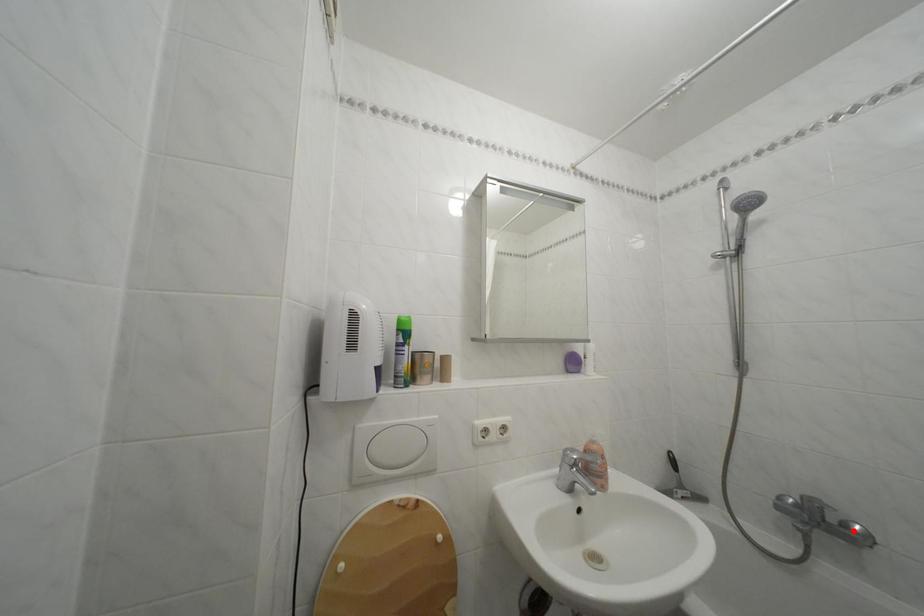
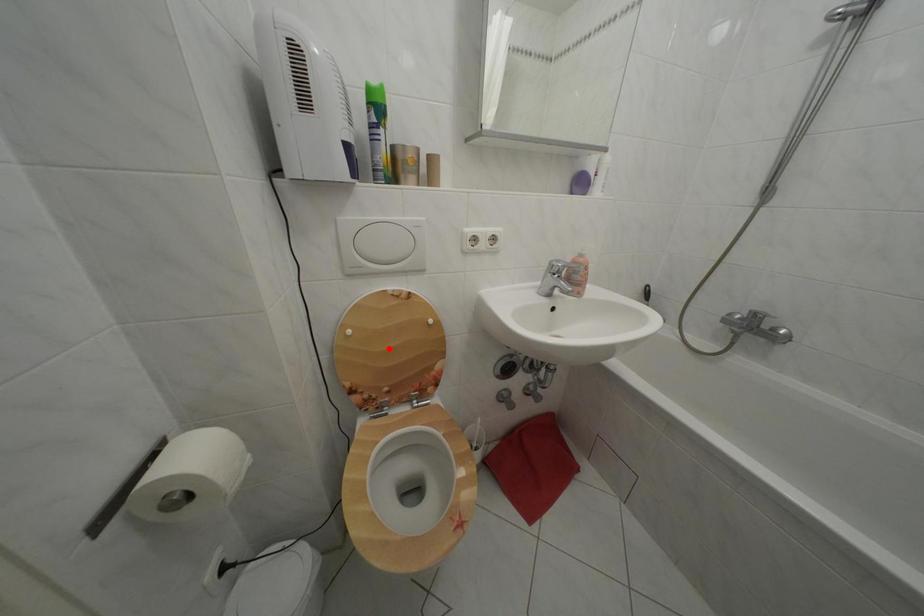
In the scene shown: I am providing you with two images of the same scene from different viewpoints. A red point is marked on the first image and another point is marked on the second image. Are the points marked in image1 and image2 representing the same 3D position?

No